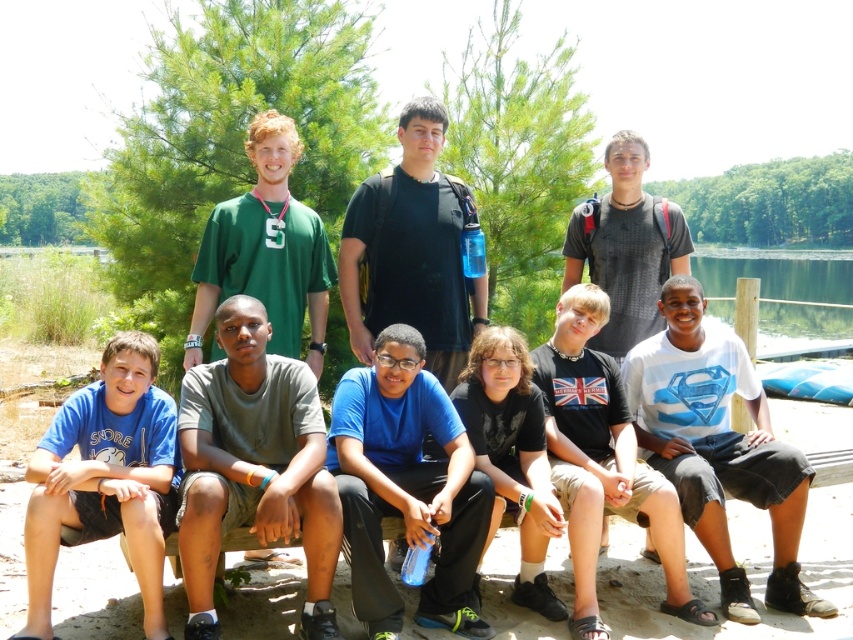
Question: Based on their relative distances, which object is farther from the white cotton shirt at center?

Choices:
 (A) blue cotton shirt at center
 (B) black matte shirt at center
 (C) black matte shirt at upper center
 (D) gray cotton shirt at center

Answer: (D)

Question: Which point is closer to the camera taking this photo?

Choices:
 (A) (155, 460)
 (B) (779, 472)
 (C) (631, 228)
 (D) (401, 401)

Answer: (A)

Question: Based on their relative distances, which object is farther from the black matte shirt at upper center?

Choices:
 (A) white cotton shirt at center
 (B) white cotton shirt at lower right
 (C) blue cotton shirt at lower left

Answer: (C)

Question: Can you confirm if white cotton shirt at lower right is wider than black matte shirt at upper center?

Choices:
 (A) yes
 (B) no

Answer: (A)

Question: Is black matte shirt at center positioned before white cotton shirt at center?

Choices:
 (A) no
 (B) yes

Answer: (A)

Question: Does white cotton shirt at lower right appear under black matte shirt at upper center?

Choices:
 (A) yes
 (B) no

Answer: (A)